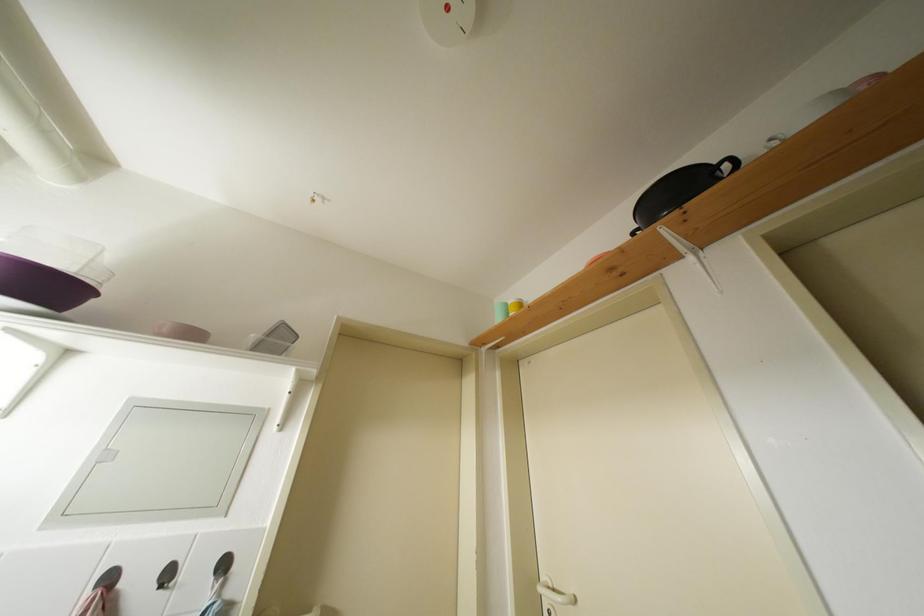
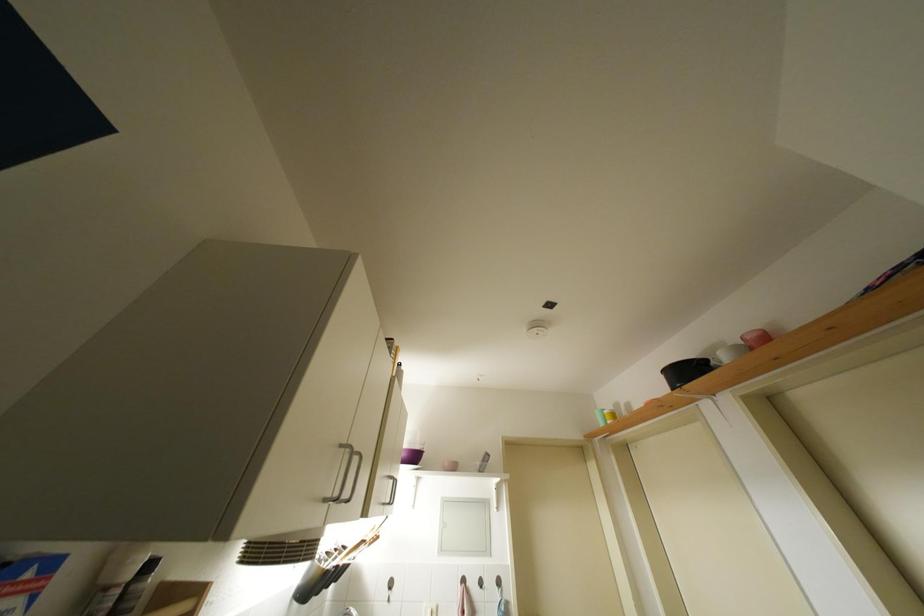
The point at (71,517) is marked in the first image. Where is the corresponding point in the second image?

(447, 554)